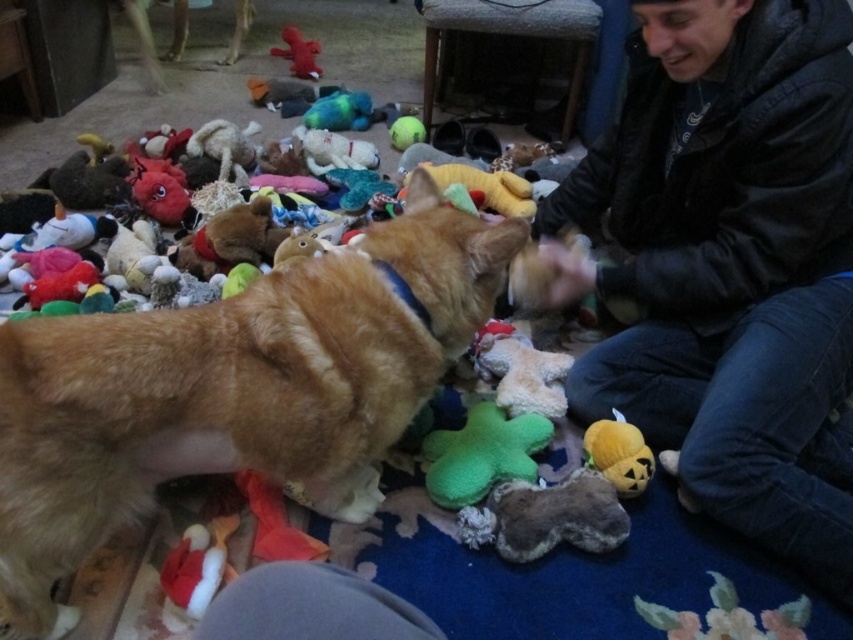
Question: Is black leather jacket at upper right wider than velvety plush toy at upper center?

Choices:
 (A) no
 (B) yes

Answer: (B)

Question: Is the position of brown plush dog at center less distant than that of green fuzzy star at center?

Choices:
 (A) yes
 (B) no

Answer: (A)

Question: From the image, what is the correct spatial relationship of brown plush dog at center in relation to green fuzzy star at center?

Choices:
 (A) below
 (B) above

Answer: (B)

Question: Among these objects, which one is farthest from the camera?

Choices:
 (A) black leather jacket at upper right
 (B) velvet pumpkin plush at lower center
 (C) green fuzzy star at center

Answer: (B)

Question: Estimate the real-world distances between objects in this image. Which object is closer to the velvet pumpkin plush at lower center?

Choices:
 (A) velvety plush toy at upper center
 (B) black leather jacket at upper right
 (C) green fuzzy star at center
 (D) brown plush dog at center

Answer: (C)

Question: Which point is farther to the camera?

Choices:
 (A) velvet pumpkin plush at lower center
 (B) black leather jacket at upper right
 (C) green fuzzy star at center
 (D) velvety plush toy at upper center

Answer: (D)